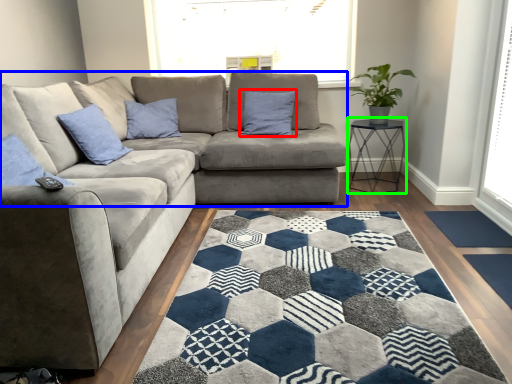
Question: Which object is the closest to the pillow (highlighted by a red box)? Choose among these: futon (highlighted by a blue box) or table (highlighted by a green box).

Choices:
 (A) futon
 (B) table

Answer: (A)